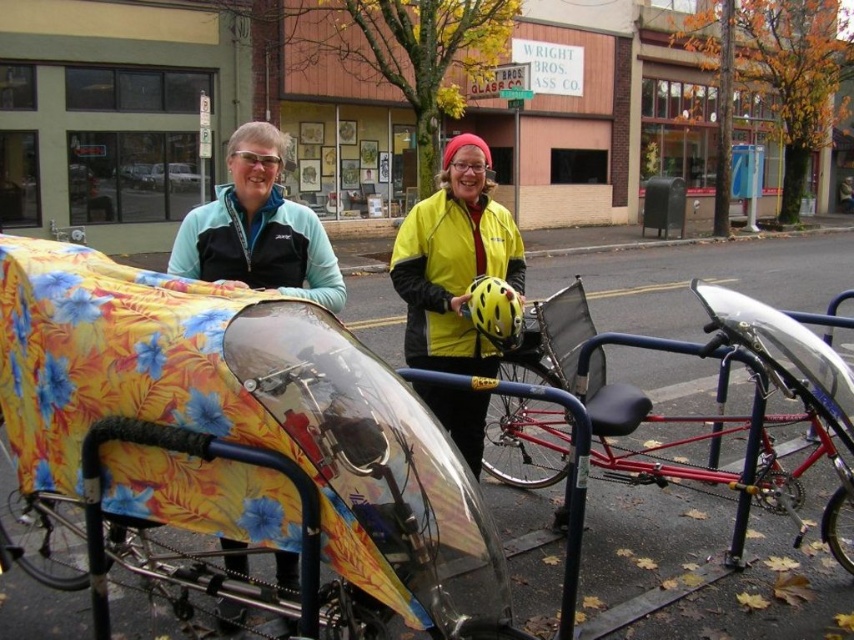
Question: Which object appears farthest from the camera in this image?

Choices:
 (A) metallic red bicycle at center
 (B) yellow matte jacket at center

Answer: (B)

Question: Is metallic red bicycle at center thinner than yellow matte jacket at center?

Choices:
 (A) no
 (B) yes

Answer: (A)

Question: Which of the following is the closest to the observer?

Choices:
 (A) yellow matte jacket at center
 (B) metallic red bicycle at center

Answer: (B)

Question: Does metallic red bicycle at center lie behind yellow matte jacket at center?

Choices:
 (A) no
 (B) yes

Answer: (A)

Question: Considering the relative positions of metallic red bicycle at center and yellow matte jacket at center in the image provided, where is metallic red bicycle at center located with respect to yellow matte jacket at center?

Choices:
 (A) right
 (B) left

Answer: (A)